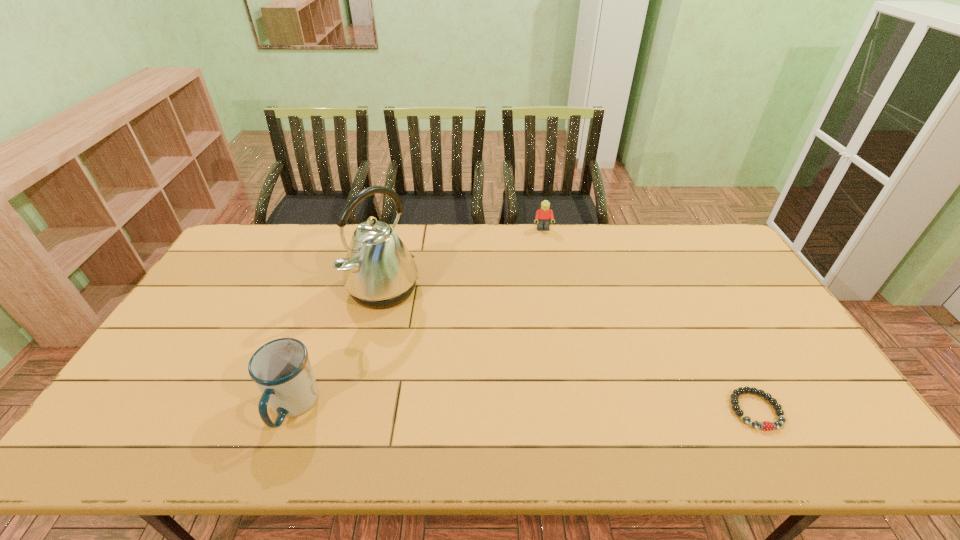
At what (x,y) coordinates should I click in order to perform the action: click on the third shortest object. Please return your answer as a coordinate pair (x, y). This screenshot has height=540, width=960. Looking at the image, I should click on (281, 368).

Find the location of a particular element. This screenshot has width=960, height=540. the rightmost object is located at coordinates (765, 425).

Identify the location of the shortest object. The width and height of the screenshot is (960, 540). (765, 425).

Locate an element on the screen. the farthest object is located at coordinates (543, 216).

At what (x,y) coordinates should I click in order to perform the action: click on the third object from left to right. Please return your answer as a coordinate pair (x, y). Image resolution: width=960 pixels, height=540 pixels. Looking at the image, I should click on (543, 216).

The image size is (960, 540). Identify the location of the tallest object. (379, 272).

The width and height of the screenshot is (960, 540). In order to click on the third nearest object in this screenshot , I will do `click(379, 272)`.

Where is `blank space located 0.150m on the right of the rightmost object`? The image size is (960, 540). blank space located 0.150m on the right of the rightmost object is located at coordinates (841, 410).

I want to click on free spot located on the face of the Lego, so click(x=559, y=302).

Where is `free space located 0.240m on the face of the Lego`? This screenshot has height=540, width=960. free space located 0.240m on the face of the Lego is located at coordinates (553, 275).